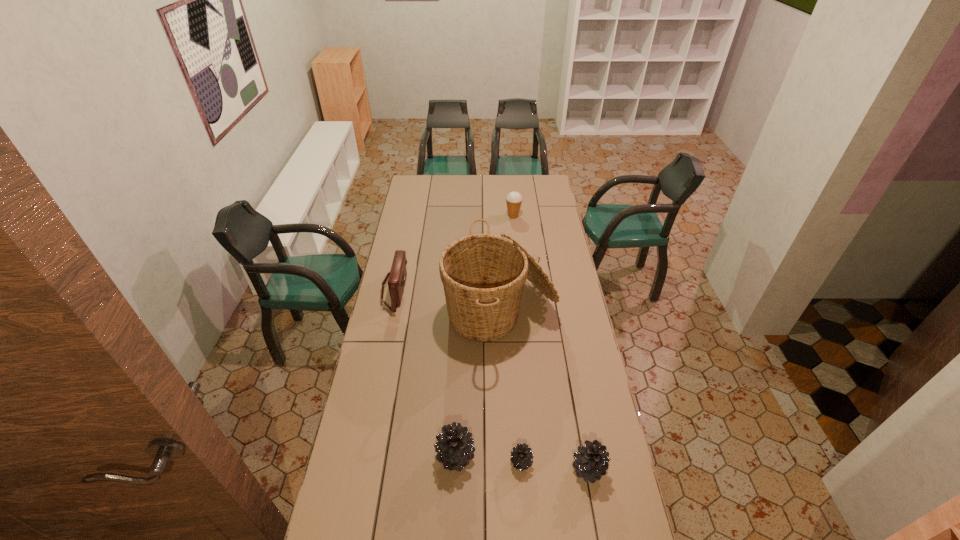
All pinecones are currently evenly spaced. To continue this pattern, where would you add another pinecone on the left? Please point out a vacant spot. Please provide its 2D coordinates. Your answer should be formatted as a tuple, i.e. [(x, y)], where the tuple contains the x and y coordinates of a point satisfying the conditions above.

[(391, 450)]